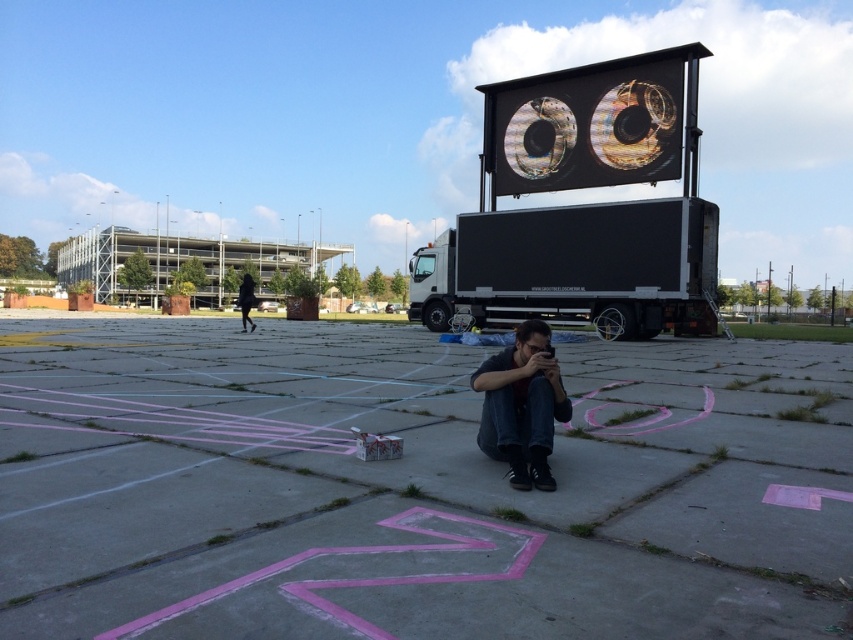
You are a delivery driver who needs to park your truck in a tight space. You see the black matte trailer truck at center and the black fabric at left in the image. Which object takes up more space in the parking area?

The black matte trailer truck at center has a larger size compared to black fabric at left, so it takes up more space in the parking area.

You are a photographer standing in front of the large truck screen. You see two points marked on the screen at point coordinates point (625, 269) and point (532, 413). Which point is closer to you?

Point (625, 269) is further to the camera than point (532, 413), so the point closer to you is point (532, 413).